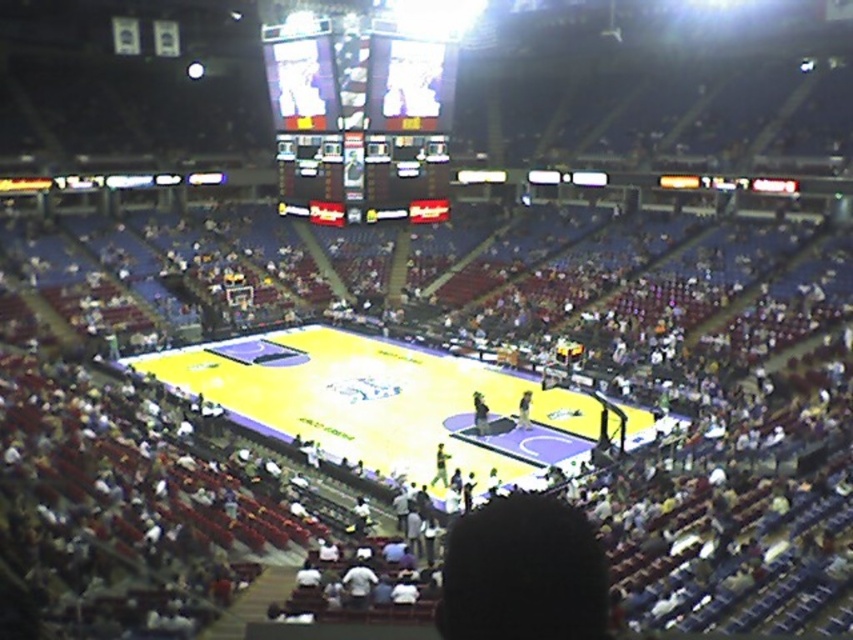
Does point (292, 387) come farther from viewer compared to point (444, 144)?

Yes.

Consider the image. Can you confirm if yellow polished wood court at center is thinner than black glossy scoreboard at center?

No, yellow polished wood court at center is not thinner than black glossy scoreboard at center.

I want to click on yellow polished wood court at center, so click(383, 403).

Is point (344, 214) closer to camera compared to point (433, 145)?

Yes, point (344, 214) is in front of point (433, 145).

Between point (379, 90) and point (354, 150), which one is positioned in front?

Point (379, 90) is more forward.

Is point (305, 179) in front of point (421, 154)?

No.

You are a GUI agent. You are given a task and a screenshot of the screen. Output one action in this format:
    pyautogui.click(x=<x>, y=<y>)
    Task: Click on the shiny digital display at upper center
    The image size is (853, 640).
    Given the screenshot: What is the action you would take?
    pyautogui.click(x=358, y=122)

Which is more to the left, yellow polished wood court at center or shiny digital display at upper center?

yellow polished wood court at center

Which is above, yellow polished wood court at center or shiny digital display at upper center?

Positioned higher is shiny digital display at upper center.

Which is behind, point (286, 435) or point (392, 211)?

Point (392, 211)

At what (x,y) coordinates should I click in order to perform the action: click on yellow polished wood court at center. Please return your answer as a coordinate pair (x, y). The image size is (853, 640). Looking at the image, I should click on (383, 403).